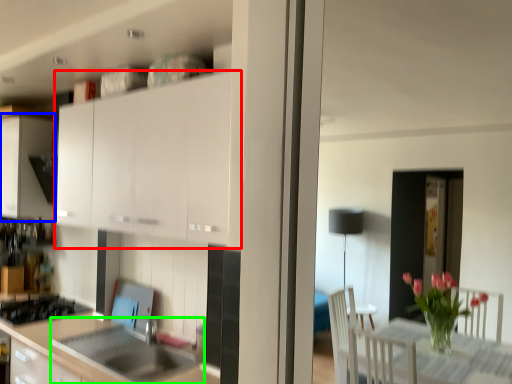
Question: Which is nearer to the cabinetry (highlighted by a red box)? cabinetry (highlighted by a blue box) or sink (highlighted by a green box).

Choices:
 (A) cabinetry
 (B) sink

Answer: (B)